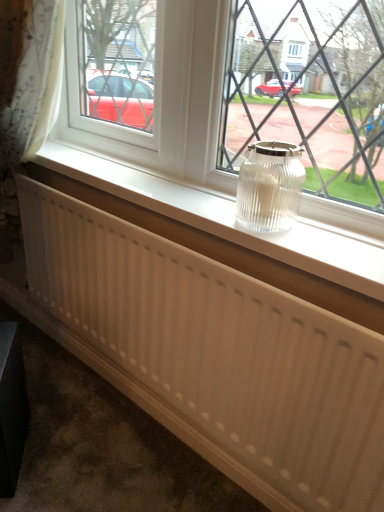
Question: Is clear glass jar at center oriented away from white ribbed radiator at center?

Choices:
 (A) yes
 (B) no

Answer: (B)

Question: Is clear glass jar at center aimed at white ribbed radiator at center?

Choices:
 (A) no
 (B) yes

Answer: (A)

Question: Considering the relative sizes of clear glass jar at center and white ribbed radiator at center in the image provided, is clear glass jar at center wider than white ribbed radiator at center?

Choices:
 (A) yes
 (B) no

Answer: (A)

Question: Is clear glass jar at center outside of white ribbed radiator at center?

Choices:
 (A) yes
 (B) no

Answer: (A)

Question: Is clear glass jar at center smaller than white ribbed radiator at center?

Choices:
 (A) no
 (B) yes

Answer: (B)

Question: Is clear glass jar at center next to white ribbed radiator at center?

Choices:
 (A) yes
 (B) no

Answer: (B)

Question: Is clear glass jar at center closer to the viewer compared to clear glass jar at center?

Choices:
 (A) no
 (B) yes

Answer: (A)

Question: Are clear glass jar at center and clear glass jar at center located far from each other?

Choices:
 (A) no
 (B) yes

Answer: (A)

Question: Could clear glass jar at center be considered to be inside clear glass jar at center?

Choices:
 (A) yes
 (B) no

Answer: (B)

Question: Is clear glass jar at center placed right next to clear glass jar at center?

Choices:
 (A) yes
 (B) no

Answer: (B)

Question: From a real-world perspective, is clear glass jar at center on top of clear glass jar at center?

Choices:
 (A) yes
 (B) no

Answer: (B)

Question: From the image's perspective, does clear glass jar at center appear higher than clear glass jar at center?

Choices:
 (A) yes
 (B) no

Answer: (B)

Question: Can you confirm if white plastic radiator at center is shorter than white ribbed radiator at center?

Choices:
 (A) yes
 (B) no

Answer: (A)